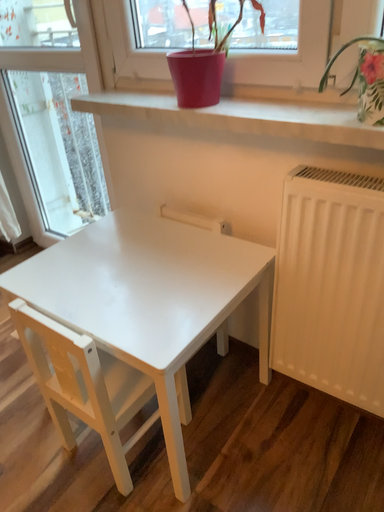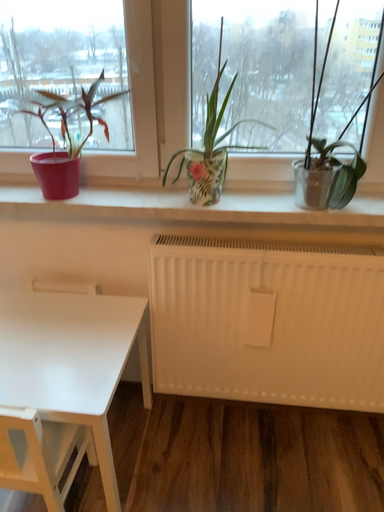
Question: Which way did the camera rotate in the video?

Choices:
 (A) rotated upward
 (B) rotated downward

Answer: (A)